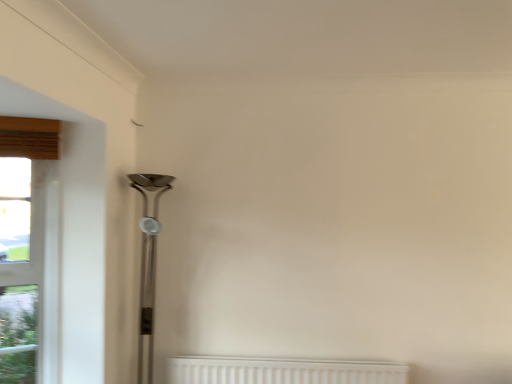
Question: Is polished silver table lamp at left facing away from clear glass window at left?

Choices:
 (A) no
 (B) yes

Answer: (A)

Question: From a real-world perspective, is polished silver table lamp at left located higher than clear glass window at left?

Choices:
 (A) yes
 (B) no

Answer: (A)

Question: From a real-world perspective, does polished silver table lamp at left sit lower than clear glass window at left?

Choices:
 (A) no
 (B) yes

Answer: (A)

Question: Is polished silver table lamp at left positioned in front of clear glass window at left?

Choices:
 (A) no
 (B) yes

Answer: (A)

Question: Considering the relative sizes of polished silver table lamp at left and clear glass window at left in the image provided, is polished silver table lamp at left smaller than clear glass window at left?

Choices:
 (A) no
 (B) yes

Answer: (A)

Question: Is polished silver table lamp at left aimed at clear glass window at left?

Choices:
 (A) yes
 (B) no

Answer: (B)

Question: Considering the relative positions of clear glass window at left and polished silver table lamp at left in the image provided, is clear glass window at left in front of polished silver table lamp at left?

Choices:
 (A) yes
 (B) no

Answer: (A)

Question: Can you confirm if clear glass window at left is bigger than polished silver table lamp at left?

Choices:
 (A) no
 (B) yes

Answer: (A)

Question: Is clear glass window at left at the left side of polished silver table lamp at left?

Choices:
 (A) yes
 (B) no

Answer: (A)

Question: From the image's perspective, is clear glass window at left located beneath polished silver table lamp at left?

Choices:
 (A) yes
 (B) no

Answer: (A)

Question: From a real-world perspective, does clear glass window at left stand above polished silver table lamp at left?

Choices:
 (A) yes
 (B) no

Answer: (B)

Question: From a real-world perspective, does clear glass window at left sit lower than polished silver table lamp at left?

Choices:
 (A) no
 (B) yes

Answer: (B)

Question: Based on their sizes in the image, would you say clear glass window at left is bigger or smaller than polished silver table lamp at left?

Choices:
 (A) big
 (B) small

Answer: (B)